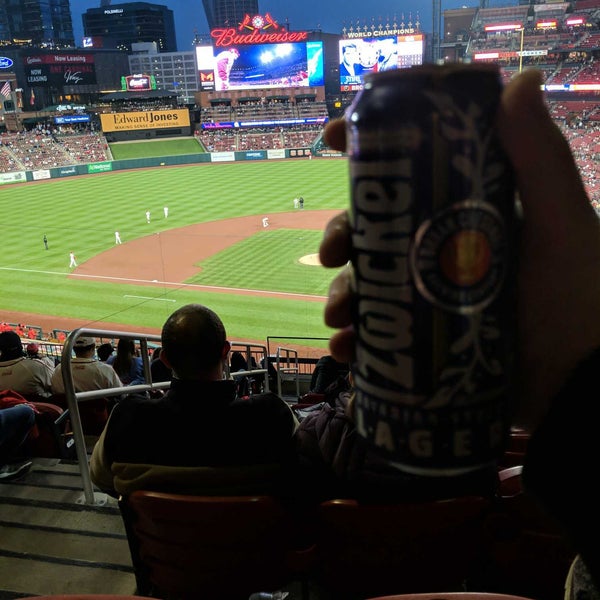
Where is `handrail`? handrail is located at coordinates (117, 332), (248, 342), (277, 353).